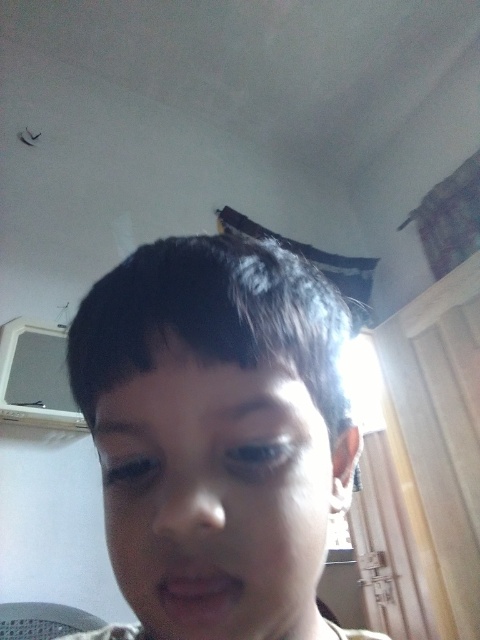
Question: Does smooth skin face at center appear over dark brown hair at upper center?

Choices:
 (A) no
 (B) yes

Answer: (A)

Question: Which object appears closest to the camera in this image?

Choices:
 (A) dark brown hair at upper center
 (B) smooth skin face at center
 (C) dark brown hair at upper left

Answer: (B)

Question: Which of the following is the farthest from the observer?

Choices:
 (A) (233, 416)
 (B) (109, 428)
 (C) (171, 342)

Answer: (B)

Question: Which object is closer to the camera taking this photo?

Choices:
 (A) dark brown hair at upper left
 (B) dark brown hair at upper center

Answer: (B)

Question: Does smooth skin face at center have a larger size compared to dark brown hair at upper left?

Choices:
 (A) yes
 (B) no

Answer: (A)

Question: Does smooth skin face at center lie in front of dark brown hair at upper left?

Choices:
 (A) no
 (B) yes

Answer: (B)